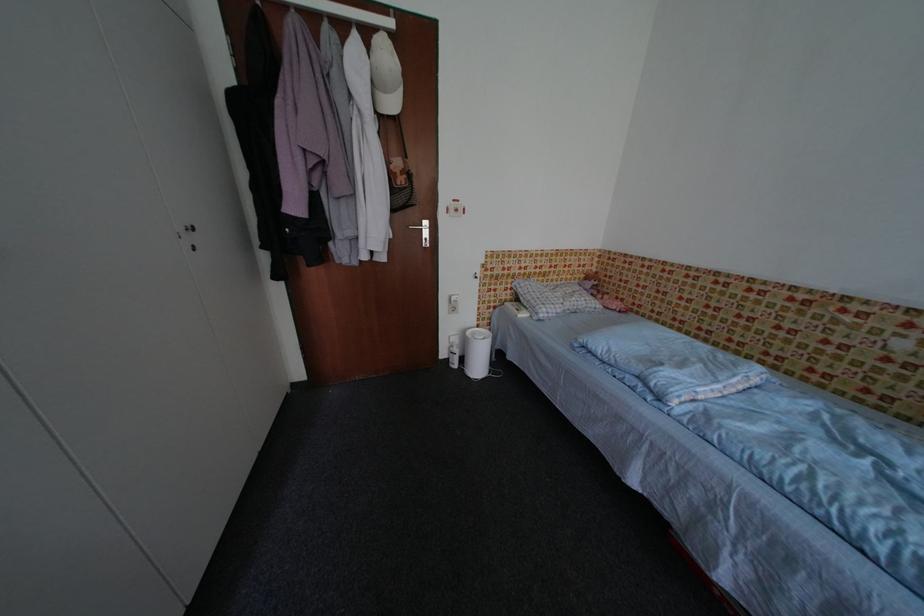
Locate an element on the screen. The image size is (924, 616). silver door handle is located at coordinates (420, 225).